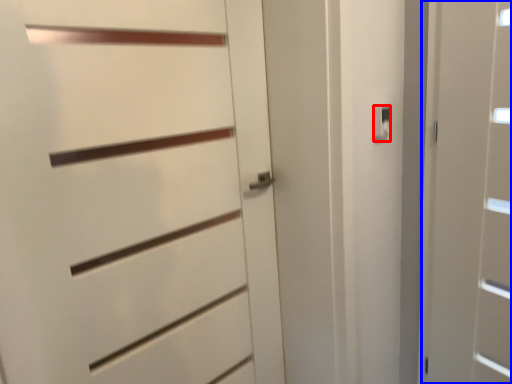
Question: Which point is further to the camera, latch (highlighted by a red box) or door (highlighted by a blue box)?

Choices:
 (A) latch
 (B) door

Answer: (A)